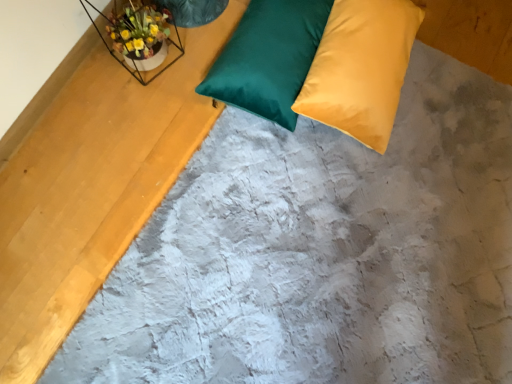
Find the location of a particular element. The image size is (512, 384). metallic wire frame at upper left is located at coordinates (139, 37).

Is metallic wire frame at upper left far from matte yellow pillow at upper right, the second pillow positioned from the left?

They are positioned close to each other.

Which object is positioned more to the right, metallic wire frame at upper left or matte yellow pillow at upper right, the second pillow positioned from the left?

matte yellow pillow at upper right, the second pillow positioned from the left, is more to the right.

Between point (124, 34) and point (356, 26), which one is positioned in front?

The point (356, 26) is closer to the camera.

In the scene shown: From a real-world perspective, which object rests below the other?

matte yellow pillow at upper right, the 1th pillow in the right-to-left sequence, from a real-world perspective.

Considering the points (382, 8) and (158, 24), which point is in front, point (382, 8) or point (158, 24)?

Positioned in front is point (382, 8).

Is matte yellow pillow at upper right, the 1th pillow in the right-to-left sequence, bigger than metallic wire frame at upper left?

Correct, matte yellow pillow at upper right, the 1th pillow in the right-to-left sequence, is larger in size than metallic wire frame at upper left.

Is matte yellow pillow at upper right, the second pillow positioned from the left, facing away from metallic wire frame at upper left?

Correct, matte yellow pillow at upper right, the second pillow positioned from the left, is looking away from metallic wire frame at upper left.

Between matte yellow pillow at upper right, the second pillow positioned from the left, and satin green pillow at upper center, arranged as the 1th pillow when viewed from the left, which one has smaller size?

With smaller size is satin green pillow at upper center, arranged as the 1th pillow when viewed from the left.

Which of these two, matte yellow pillow at upper right, the 1th pillow in the right-to-left sequence, or satin green pillow at upper center, positioned as the 2th pillow in right-to-left order, is thinner?

Thinner between the two is satin green pillow at upper center, positioned as the 2th pillow in right-to-left order.

Looking at this image, is matte yellow pillow at upper right, the second pillow positioned from the left, in front of satin green pillow at upper center, arranged as the 1th pillow when viewed from the left?

Yes.

Does point (221, 93) come in front of point (321, 120)?

No, (221, 93) is behind (321, 120).

Who is bigger, satin green pillow at upper center, positioned as the 2th pillow in right-to-left order, or matte yellow pillow at upper right, the second pillow positioned from the left?

With larger size is matte yellow pillow at upper right, the second pillow positioned from the left.

Is matte yellow pillow at upper right, the 1th pillow in the right-to-left sequence, at the back of satin green pillow at upper center, arranged as the 1th pillow when viewed from the left?

That's not correct — satin green pillow at upper center, arranged as the 1th pillow when viewed from the left, is not looking away from matte yellow pillow at upper right, the 1th pillow in the right-to-left sequence.

Considering the sizes of objects satin green pillow at upper center, positioned as the 2th pillow in right-to-left order, and matte yellow pillow at upper right, the second pillow positioned from the left, in the image provided, who is taller, satin green pillow at upper center, positioned as the 2th pillow in right-to-left order, or matte yellow pillow at upper right, the second pillow positioned from the left,?

Standing taller between the two is matte yellow pillow at upper right, the second pillow positioned from the left.

Is satin green pillow at upper center, positioned as the 2th pillow in right-to-left order, bigger or smaller than metallic wire frame at upper left?

Considering their sizes, satin green pillow at upper center, positioned as the 2th pillow in right-to-left order, takes up more space than metallic wire frame at upper left.

Which object is positioned more to the right, satin green pillow at upper center, positioned as the 2th pillow in right-to-left order, or metallic wire frame at upper left?

From the viewer's perspective, satin green pillow at upper center, positioned as the 2th pillow in right-to-left order, appears more on the right side.

Does satin green pillow at upper center, positioned as the 2th pillow in right-to-left order, have a lesser width compared to metallic wire frame at upper left?

In fact, satin green pillow at upper center, positioned as the 2th pillow in right-to-left order, might be wider than metallic wire frame at upper left.

From the image's perspective, is satin green pillow at upper center, positioned as the 2th pillow in right-to-left order, beneath metallic wire frame at upper left?

Correct, satin green pillow at upper center, positioned as the 2th pillow in right-to-left order, appears lower than metallic wire frame at upper left in the image.

Are metallic wire frame at upper left and satin green pillow at upper center, arranged as the 1th pillow when viewed from the left, far apart?

metallic wire frame at upper left is near satin green pillow at upper center, arranged as the 1th pillow when viewed from the left, not far away.

Considering the sizes of objects metallic wire frame at upper left and satin green pillow at upper center, arranged as the 1th pillow when viewed from the left, in the image provided, who is taller, metallic wire frame at upper left or satin green pillow at upper center, arranged as the 1th pillow when viewed from the left,?

Standing taller between the two is metallic wire frame at upper left.

Is metallic wire frame at upper left oriented away from satin green pillow at upper center, positioned as the 2th pillow in right-to-left order?

No, satin green pillow at upper center, positioned as the 2th pillow in right-to-left order, is not at the back of metallic wire frame at upper left.

Locate an element on the screen. The width and height of the screenshot is (512, 384). window sill in front of the matte yellow pillow at upper right, the 1th pillow in the right-to-left sequence is located at coordinates (139, 37).

This screenshot has width=512, height=384. In order to click on window sill on the left of the matte yellow pillow at upper right, the second pillow positioned from the left in this screenshot , I will do `click(139, 37)`.

Looking at the image, which one is located closer to matte yellow pillow at upper right, the second pillow positioned from the left, satin green pillow at upper center, arranged as the 1th pillow when viewed from the left, or metallic wire frame at upper left?

satin green pillow at upper center, arranged as the 1th pillow when viewed from the left, lies closer to matte yellow pillow at upper right, the second pillow positioned from the left, than the other object.

Estimate the real-world distances between objects in this image. Which object is closer to matte yellow pillow at upper right, the 1th pillow in the right-to-left sequence, metallic wire frame at upper left or satin green pillow at upper center, arranged as the 1th pillow when viewed from the left?

satin green pillow at upper center, arranged as the 1th pillow when viewed from the left, lies closer to matte yellow pillow at upper right, the 1th pillow in the right-to-left sequence, than the other object.

Considering their positions, is satin green pillow at upper center, arranged as the 1th pillow when viewed from the left, positioned further to metallic wire frame at upper left than matte yellow pillow at upper right, the second pillow positioned from the left?

matte yellow pillow at upper right, the second pillow positioned from the left.

Which object lies further to the anchor point satin green pillow at upper center, positioned as the 2th pillow in right-to-left order, metallic wire frame at upper left or matte yellow pillow at upper right, the 1th pillow in the right-to-left sequence?

metallic wire frame at upper left is further to satin green pillow at upper center, positioned as the 2th pillow in right-to-left order.

Looking at the image, which one is located further to satin green pillow at upper center, positioned as the 2th pillow in right-to-left order, matte yellow pillow at upper right, the 1th pillow in the right-to-left sequence, or metallic wire frame at upper left?

metallic wire frame at upper left lies further to satin green pillow at upper center, positioned as the 2th pillow in right-to-left order, than the other object.

Looking at the image, which one is located further to metallic wire frame at upper left, matte yellow pillow at upper right, the second pillow positioned from the left, or satin green pillow at upper center, arranged as the 1th pillow when viewed from the left?

matte yellow pillow at upper right, the second pillow positioned from the left, is further to metallic wire frame at upper left.

At what (x,y) coordinates should I click in order to perform the action: click on pillow situated between metallic wire frame at upper left and matte yellow pillow at upper right, the second pillow positioned from the left, from left to right. Please return your answer as a coordinate pair (x, y). The height and width of the screenshot is (384, 512). Looking at the image, I should click on point(269,58).